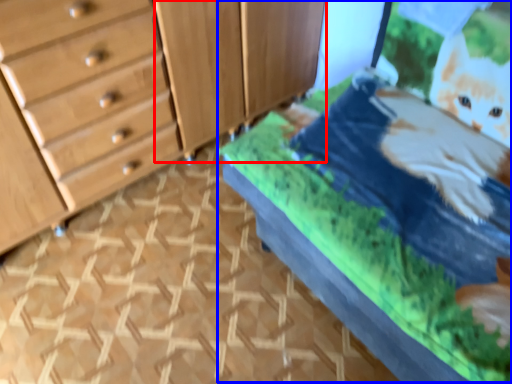
Question: Which of the following is the farthest to the observer, cabinetry (highlighted by a red box) or bed (highlighted by a blue box)?

Choices:
 (A) cabinetry
 (B) bed

Answer: (A)